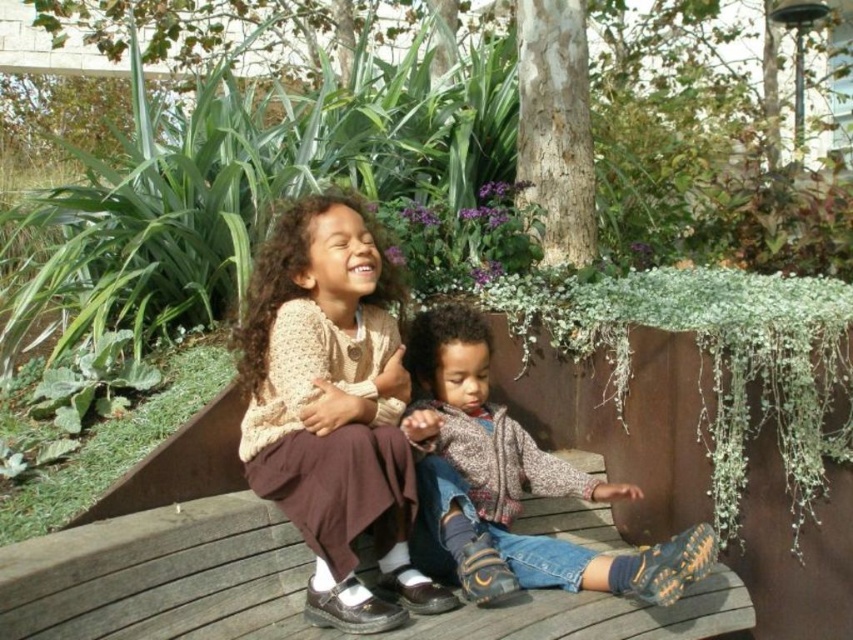
Question: Is knitted beige sweater at center closer to camera compared to knitted sweater at center?

Choices:
 (A) yes
 (B) no

Answer: (A)

Question: Which object is farther from the camera taking this photo?

Choices:
 (A) knitted beige sweater at center
 (B) knitted sweater at center

Answer: (B)

Question: In this image, where is knitted beige sweater at center located relative to knitted sweater at center?

Choices:
 (A) right
 (B) left

Answer: (B)

Question: Can you confirm if knitted beige sweater at center is bigger than knitted sweater at center?

Choices:
 (A) no
 (B) yes

Answer: (A)